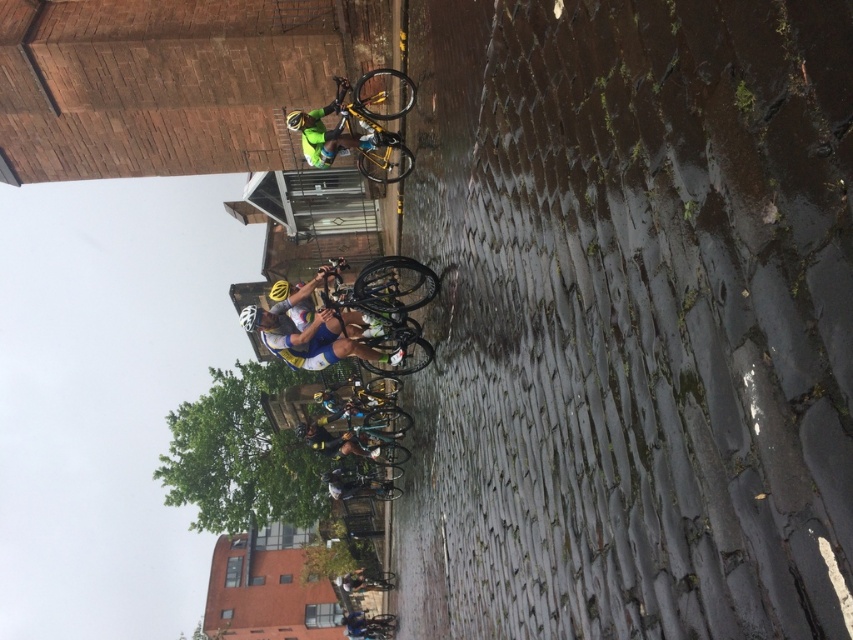
You are a photographer trying to capture a clear shot of both the yellow metallic bicycle at upper center and the reflective yellow jacket at center. Since the cobblestone street is wet, you need to ensure your camera is positioned so neither object is obscured by water reflections. Based on their positions, which object should you focus on first to avoid reflections?

The yellow metallic bicycle at upper center is to the right of the reflective yellow jacket at center. To avoid water reflections, focus on the reflective yellow jacket at center first, as it is closer to the center of the street where reflections might be more intense due to the wet cobblestones.